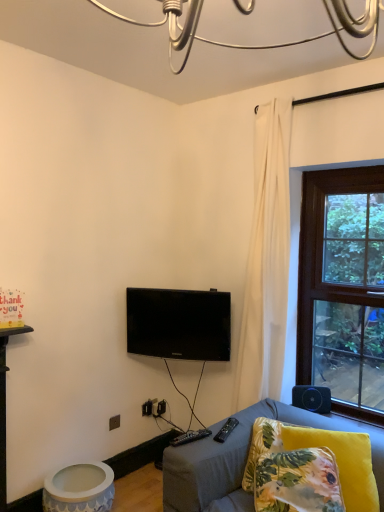
Question: Is matte white ceramic table at lower left taller or shorter than yellow floral pillow at lower right, the first pillow when ordered from left to right?

Choices:
 (A) tall
 (B) short

Answer: (A)

Question: Considering their positions, is matte white ceramic table at lower left located in front of or behind yellow floral pillow at lower right, the first pillow when ordered from left to right?

Choices:
 (A) behind
 (B) front

Answer: (A)

Question: Which is farther from the yellow floral fabric pillow at lower right, marked as the 2th pillow in a left-to-right arrangement?

Choices:
 (A) matte white ceramic table at lower left
 (B) velvet gray couch at lower right
 (C) black glossy tv at center
 (D) black plastic remote at lower center, the second remote from the right
 (E) black fabric speaker at lower right

Answer: (A)

Question: Which object is positioned closest to the black fabric speaker at lower right?

Choices:
 (A) black plastic remote at lower center, placed as the first remote when sorted from left to right
 (B) velvet gray couch at lower right
 (C) matte white ceramic table at lower left
 (D) black plastic remote at lower center, the second remote in the left-to-right sequence
 (E) black glossy tv at center

Answer: (B)